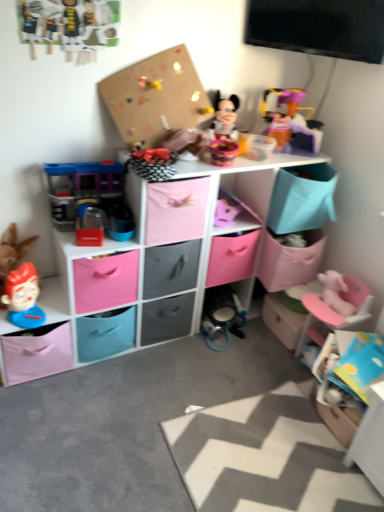
This screenshot has width=384, height=512. I want to click on vacant space in front of pink fabric storage cubes at center, so (x=124, y=411).